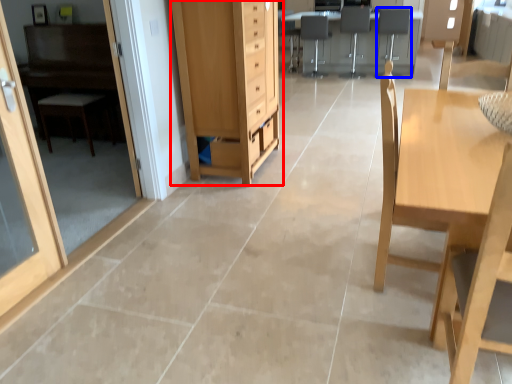
Question: Which object is further to the camera taking this photo, cabinetry (highlighted by a red box) or armchair (highlighted by a blue box)?

Choices:
 (A) cabinetry
 (B) armchair

Answer: (B)